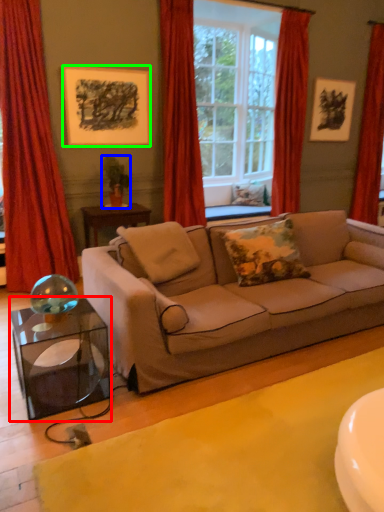
Question: Considering the real-world distances, which object is closest to table (highlighted by a red box)? houseplant (highlighted by a blue box) or picture frame (highlighted by a green box).

Choices:
 (A) houseplant
 (B) picture frame

Answer: (A)